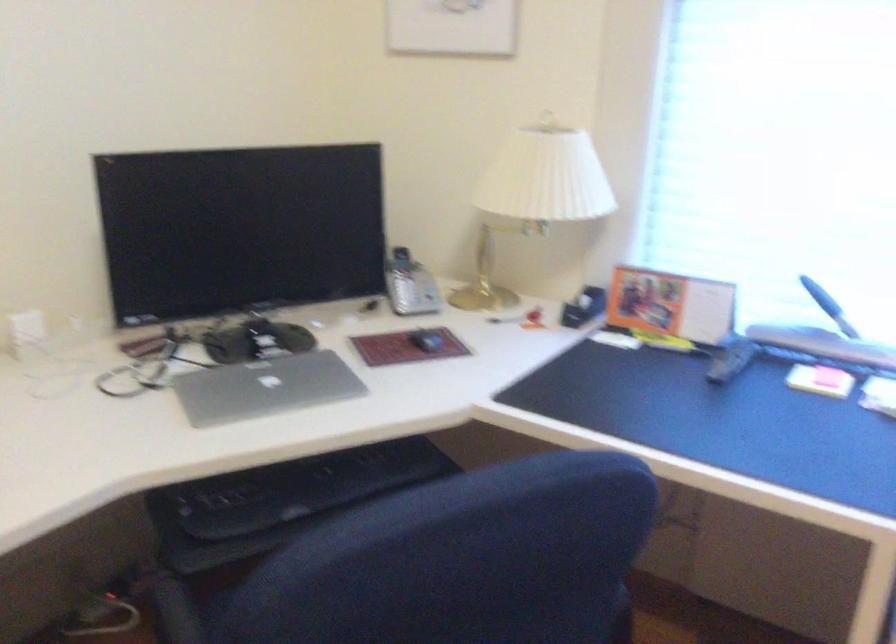
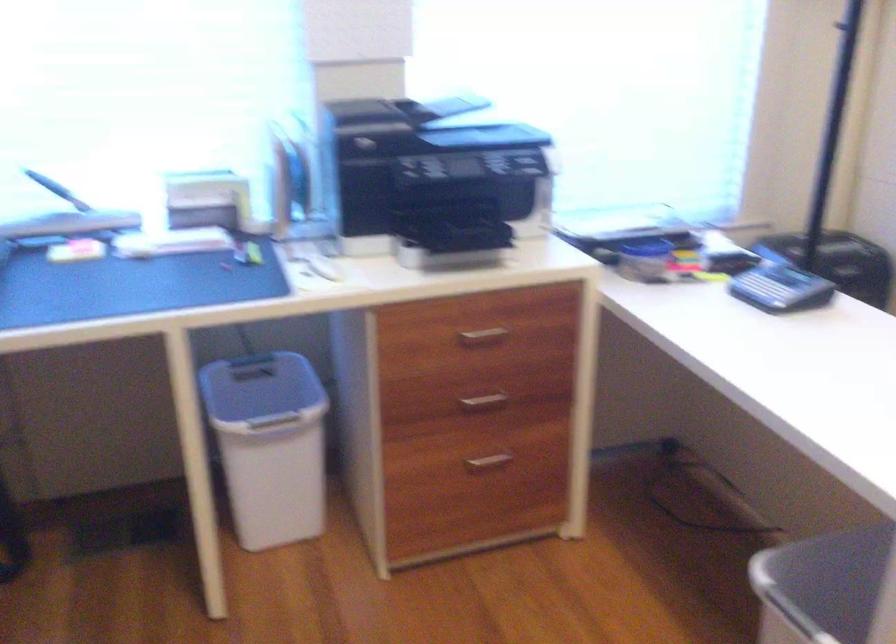
Question: The first image is from the beginning of the video and the second image is from the end. How did the camera likely rotate when shooting the video?

Choices:
 (A) Left
 (B) Right
 (C) Up
 (D) Down

Answer: (B)